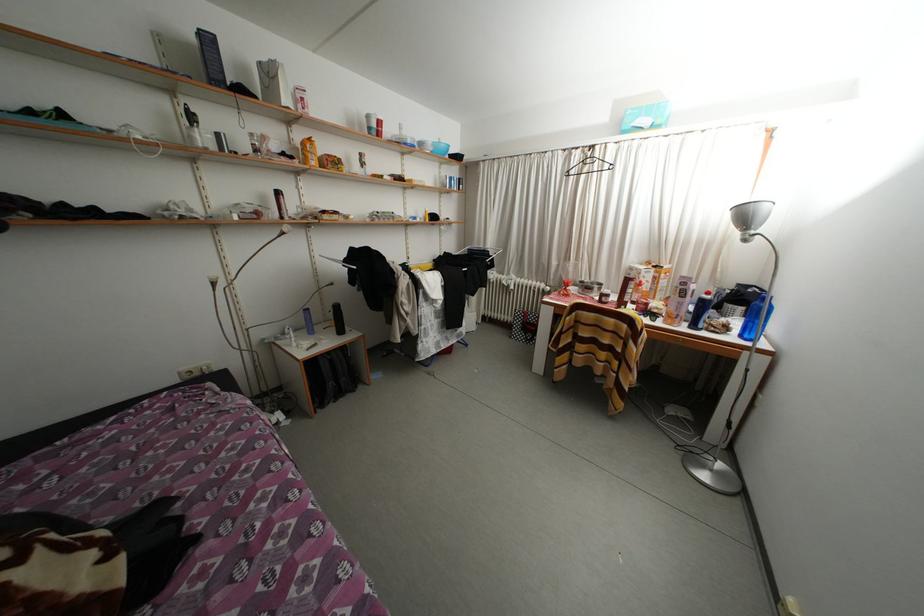
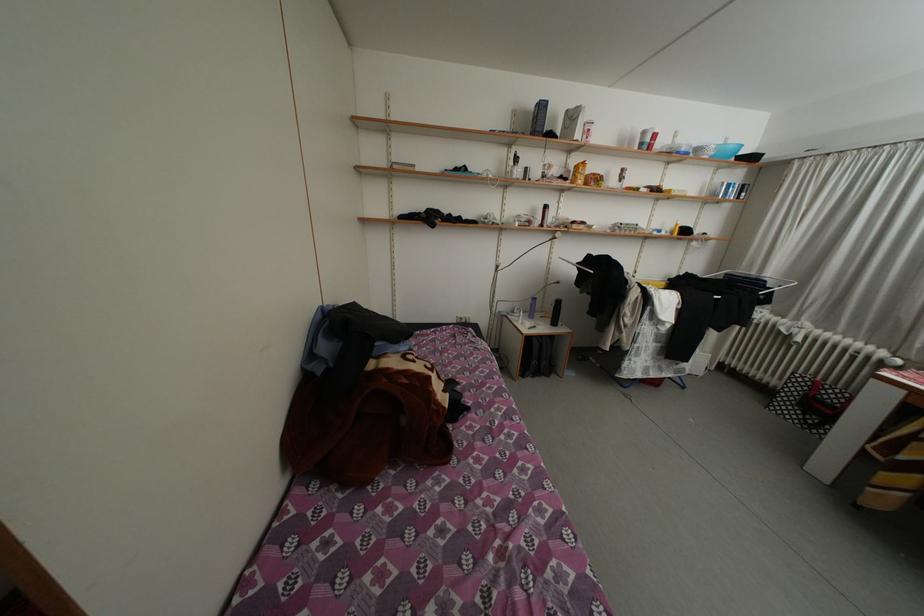
Where in the second image is the point corresponding to (378,132) from the first image?

(650, 148)